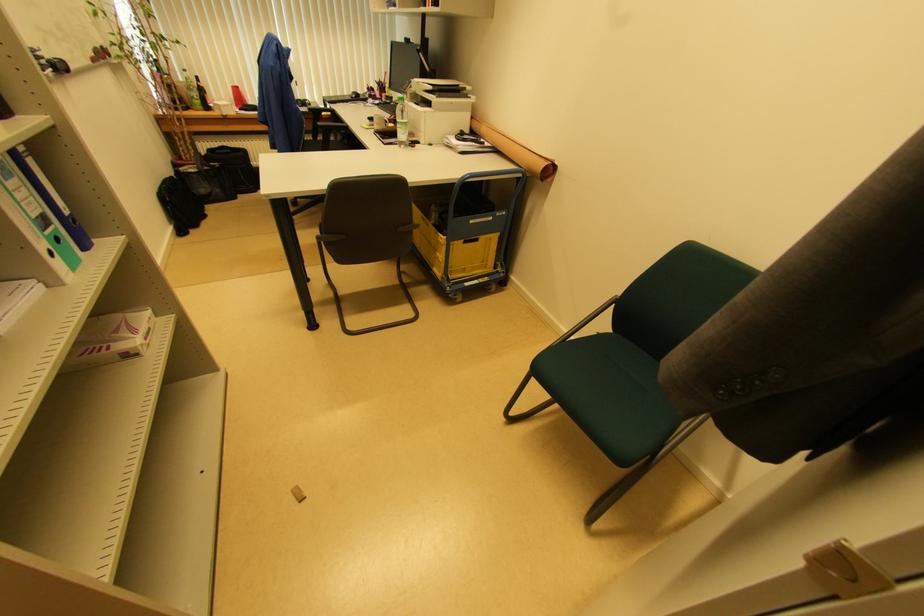
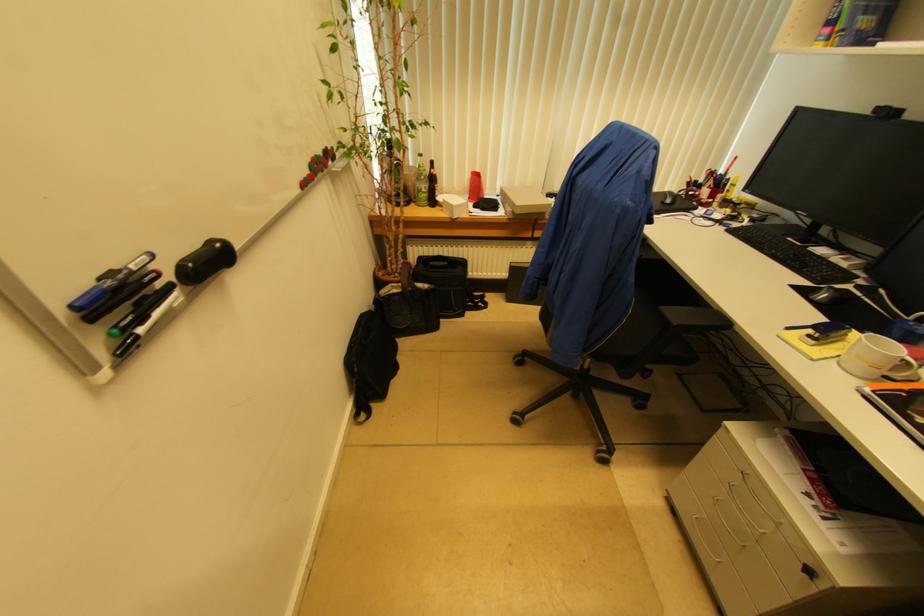
Which direction would the cameraman need to move to produce the second image?

The cameraman moved toward left, forward.